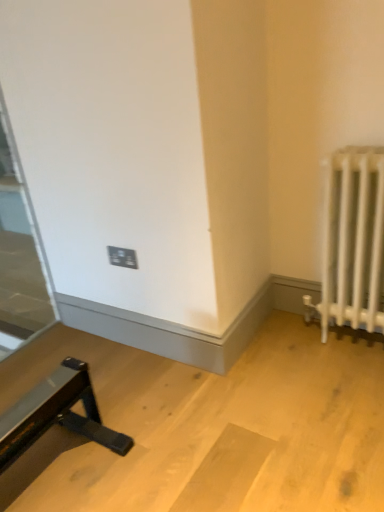
Identify the location of free region under white metal radiator at right (from a real-world perspective). (358, 338).